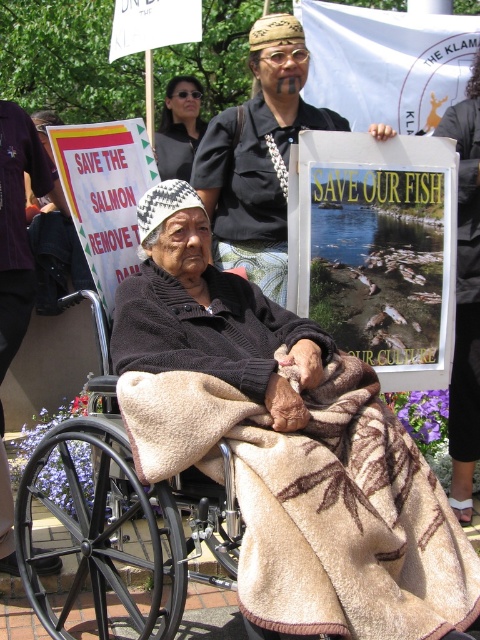
Describe the element at coordinates (316, 502) in the screenshot. I see `beige woolen blanket at center` at that location.

Identify the location of beige woolen blanket at center. coord(316,502).

Does point (358, 433) come behind point (179, 164)?

No, (358, 433) is in front of (179, 164).

Identify the location of beige woolen blanket at center. This screenshot has width=480, height=640. (316, 502).

Which is above, black fabric shirt at center or matte black sunglasses at upper center?

matte black sunglasses at upper center is above.

Is black fabric shirt at center further to the viewer compared to matte black sunglasses at upper center?

No, black fabric shirt at center is closer to the viewer.

This screenshot has height=640, width=480. What are the coordinates of `black fabric shirt at center` in the screenshot? It's located at (259, 156).

Which is in front, point (470, 593) or point (222, 120)?

Point (470, 593) is in front.

Where is `beige woolen blanket at center`? beige woolen blanket at center is located at coordinates [x=316, y=502].